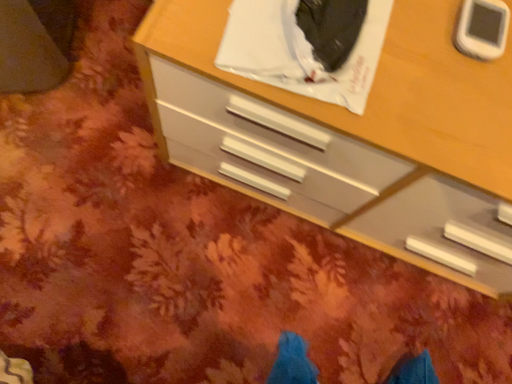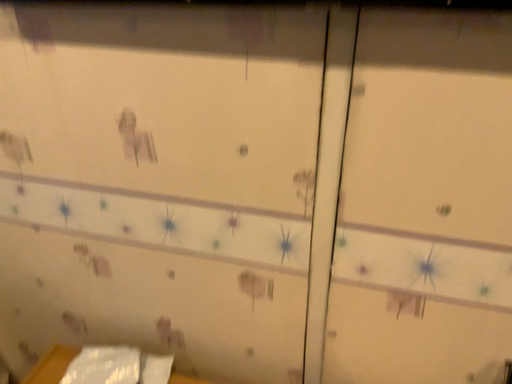
Question: How did the camera likely rotate when shooting the video?

Choices:
 (A) rotated left
 (B) rotated right

Answer: (A)